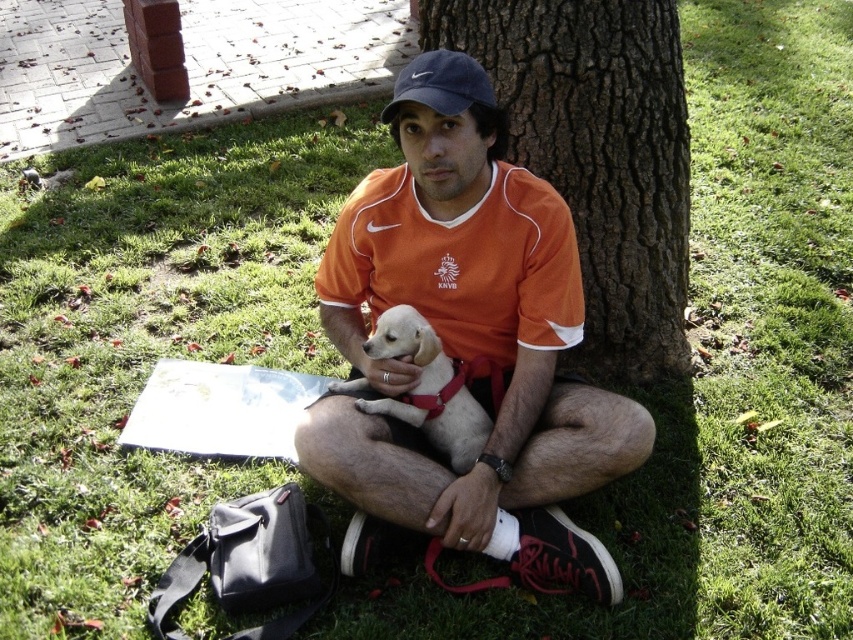
Who is more distant from viewer, (469, 497) or (393, 337)?

Positioned behind is point (393, 337).

Which is more to the right, orange jersey at center or white fur dog at center?

From the viewer's perspective, orange jersey at center appears more on the right side.

Between point (569, 410) and point (430, 349), which one is positioned behind?

Point (569, 410)

You are a GUI agent. You are given a task and a screenshot of the screen. Output one action in this format:
    pyautogui.click(x=<x>, y=<y>)
    Task: Click on the orange jersey at center
    Image resolution: width=853 pixels, height=640 pixels.
    Given the screenshot: What is the action you would take?
    pyautogui.click(x=465, y=340)

Can you confirm if orange jersey at center is positioned below matte blue baseball cap at upper center?

Indeed, orange jersey at center is positioned under matte blue baseball cap at upper center.

Is orange jersey at center to the left of matte blue baseball cap at upper center from the viewer's perspective?

In fact, orange jersey at center is to the right of matte blue baseball cap at upper center.

Which is behind, point (440, 323) or point (409, 81)?

The point (440, 323) is more distant.

Locate an element on the screen. orange jersey at center is located at coordinates (465, 340).

Which is above, brown rough bark tree at center or white fur dog at center?

Positioned higher is brown rough bark tree at center.

Find the location of a particular element. The height and width of the screenshot is (640, 853). brown rough bark tree at center is located at coordinates (596, 156).